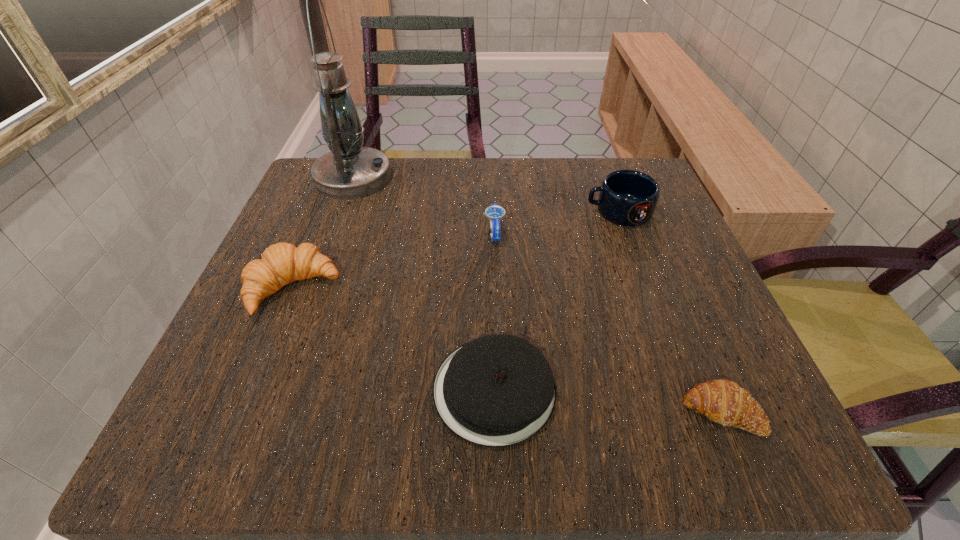
Where is `vacant position at the right edge of the desktop`? vacant position at the right edge of the desktop is located at coordinates (695, 346).

In the image, there is a desktop. Identify the location of vacant space at the far left corner. (352, 221).

Identify the location of free space at the far right corner of the desktop. (583, 184).

What are the coordinates of `free space at the near right corner of the desktop` in the screenshot? It's located at (794, 449).

Where is `vacant area that lies between the mug and the taller crescent roll`? The width and height of the screenshot is (960, 540). vacant area that lies between the mug and the taller crescent roll is located at coordinates (456, 251).

In order to click on blank region between the mug and the right crescent roll in this screenshot , I will do tap(670, 312).

Find the location of a particular element. free space between the oil lamp and the pancake is located at coordinates [423, 284].

Where is `empty space that is in between the watch and the pancake`? empty space that is in between the watch and the pancake is located at coordinates (494, 312).

Locate an element on the screen. This screenshot has width=960, height=540. vacant space in between the tallest object and the mug is located at coordinates (486, 195).

At what (x,y) coordinates should I click in order to perform the action: click on vacant space that's between the third nearest object and the watch. Please return your answer as a coordinate pair (x, y). The image size is (960, 540). Looking at the image, I should click on (395, 261).